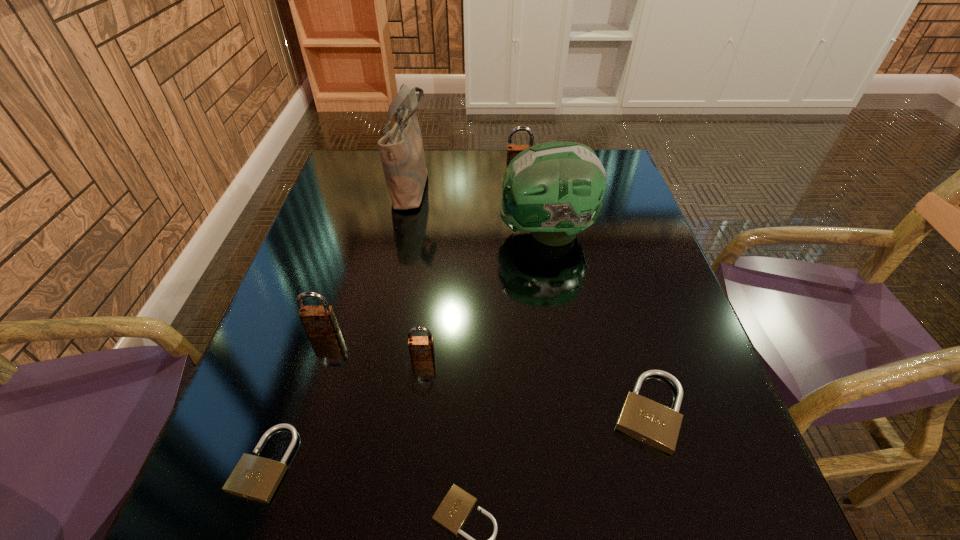
The width and height of the screenshot is (960, 540). Find the location of `the biggest beige padlock`. the biggest beige padlock is located at coordinates (652, 423).

This screenshot has width=960, height=540. In order to click on the fourth tallest padlock in this screenshot , I will do coord(652,423).

Where is `the leftmost beige padlock`? the leftmost beige padlock is located at coordinates (256, 478).

Locate an element on the screen. This screenshot has height=540, width=960. the second shortest padlock is located at coordinates (256, 478).

Identify the location of free location located 0.100m on the front-facing side of the shoulder bag. The width and height of the screenshot is (960, 540). (466, 186).

Where is `free space located 0.200m on the visor of the seventh shortest object`? This screenshot has height=540, width=960. free space located 0.200m on the visor of the seventh shortest object is located at coordinates (419, 233).

Image resolution: width=960 pixels, height=540 pixels. I want to click on free space located 0.330m on the visor of the seventh shortest object, so click(367, 233).

In order to click on vacant space situated on the visor of the seventh shortest object in this screenshot , I will do `click(474, 233)`.

The width and height of the screenshot is (960, 540). In order to click on free space located 0.350m on the front-facing side of the biggest brown padlock in this screenshot , I will do pyautogui.click(x=528, y=257).

Locate an element on the screen. This screenshot has height=540, width=960. blank space located 0.230m on the front-facing side of the leftmost brown padlock is located at coordinates click(x=287, y=451).